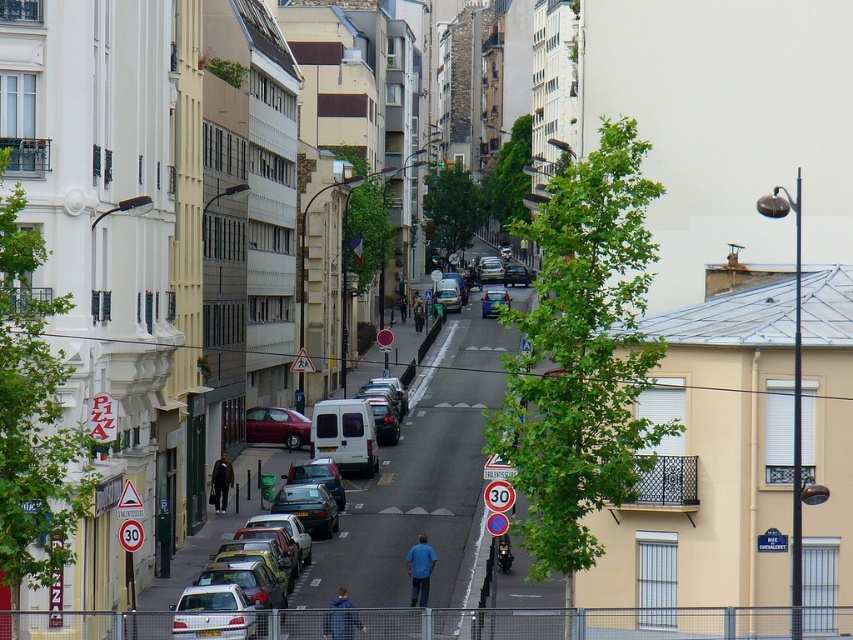
This screenshot has height=640, width=853. I want to click on matte white van at center, so click(363, 566).

Does matte white van at center come in front of metallic blue car at center?

Yes, it is in front of metallic blue car at center.

Between point (352, 566) and point (490, 291), which one is positioned behind?

The point (490, 291) is behind.

The height and width of the screenshot is (640, 853). I want to click on matte white van at center, so click(x=363, y=566).

Who is higher up, matte white van at center or dark gray fabric coat at lower left?

dark gray fabric coat at lower left is higher up.

Does point (363, 557) come closer to viewer compared to point (210, 493)?

Yes, point (363, 557) is in front of point (210, 493).

Identify the location of matte white van at center. The width and height of the screenshot is (853, 640). [x=363, y=566].

Between metallic maroon car at center and shiny black car at center, which one is positioned lower?

Positioned lower is metallic maroon car at center.

Does point (299, 429) come in front of point (393, 440)?

That is False.

At what (x,y) coordinates should I click in order to perform the action: click on metallic maroon car at center. Please return your answer as a coordinate pair (x, y). The height and width of the screenshot is (640, 853). Looking at the image, I should click on click(276, 426).